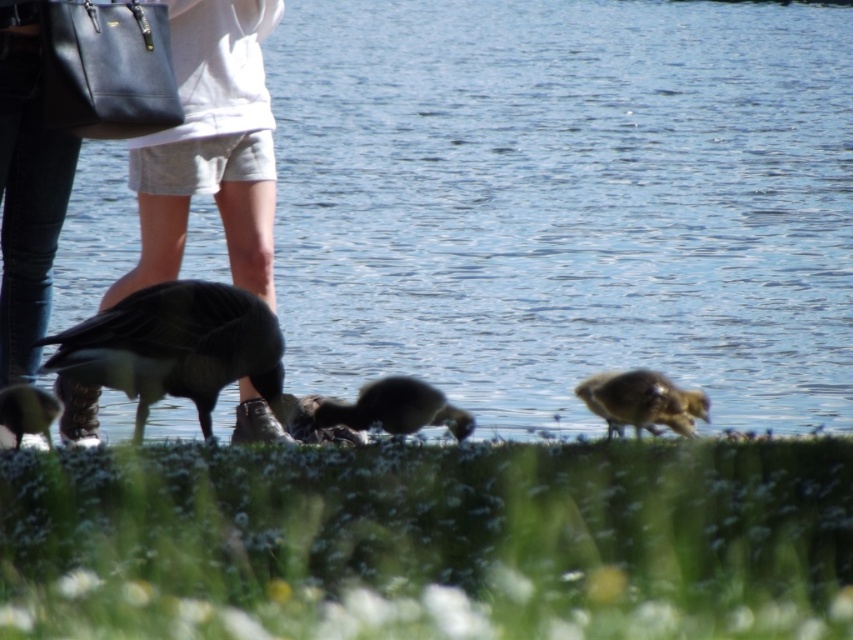
You are a photographer trying to capture a photo of the clear blue water at center and the matte black bag at lower left. Which object appears taller in the frame?

The clear blue water at center appears taller than the matte black bag at lower left in the frame.

You are a photographer trying to capture the brown fuzzy duckling at lower right and the dark brown feathers at lower left in the same frame. Based on their sizes, which one should you zoom in on to ensure both fit comfortably in your shot?

The brown fuzzy duckling at lower right is taller than the dark brown feathers at lower left. To ensure both fit comfortably in the frame, you should zoom out slightly so that the taller duckling is fully visible, allowing the smaller feathers to also be included without cropping.

You are a photographer trying to capture a closeup of the brown fuzzy duckling at lower right and the dark brown feathers at lower left. Which one would require you to zoom in more to fill the frame?

The dark brown feathers at lower left would require more zooming in because they are smaller in size compared to the brown fuzzy duckling at lower right.